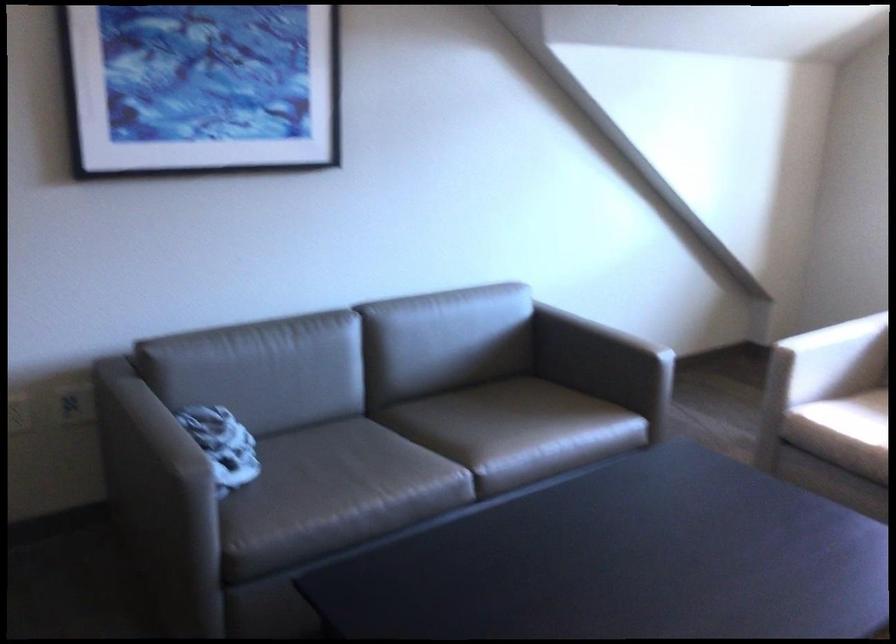
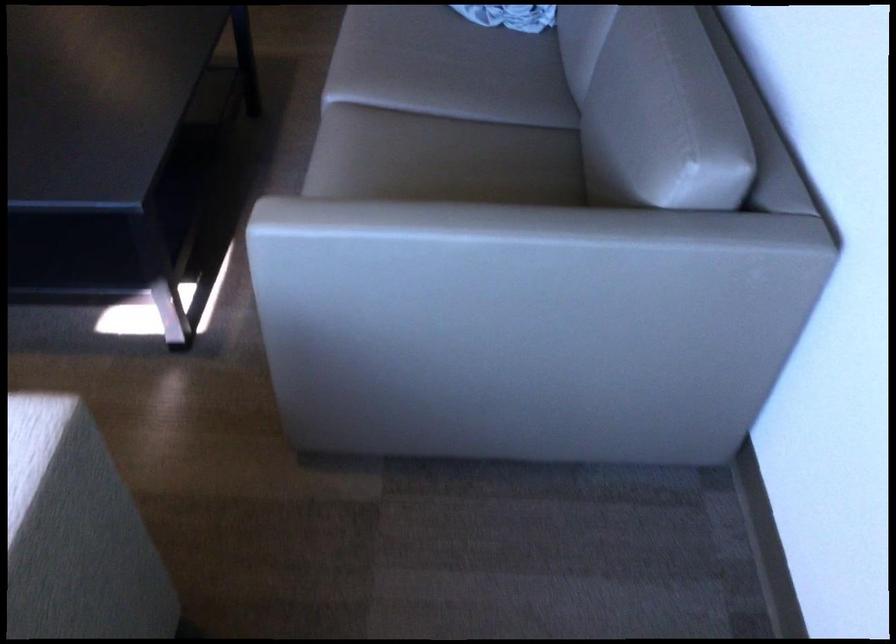
The point at (x=343, y=450) is marked in the first image. Where is the corresponding point in the second image?

(463, 73)